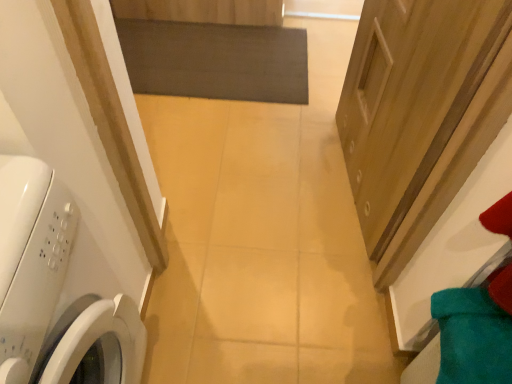
Locate an element on the screen. The height and width of the screenshot is (384, 512). vacant area situated below wooden door at right (from a real-world perspective) is located at coordinates (344, 184).